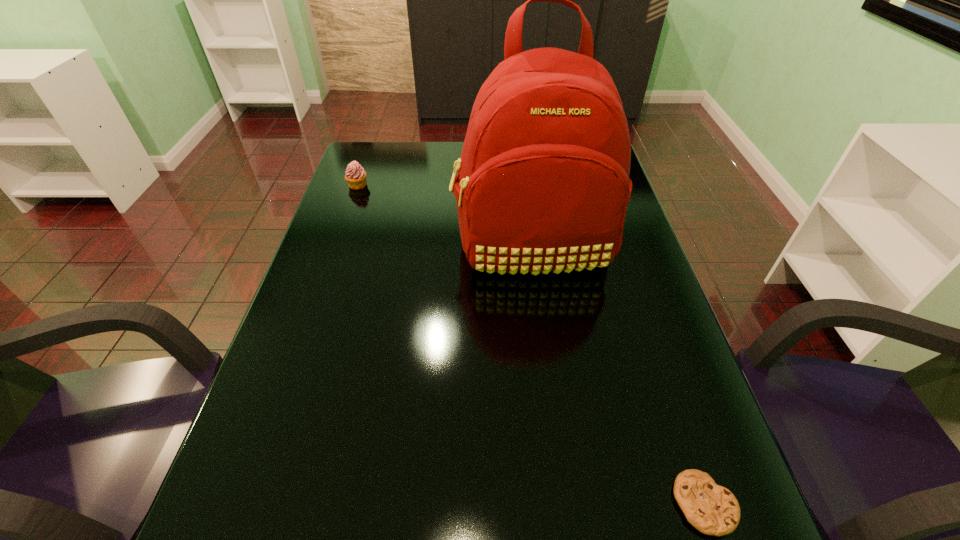
Where is `vacant space that satisfies the following two spatial constraints: 1. on the front-facing side of the backpack; 2. on the right side of the cookie`? vacant space that satisfies the following two spatial constraints: 1. on the front-facing side of the backpack; 2. on the right side of the cookie is located at coordinates (565, 504).